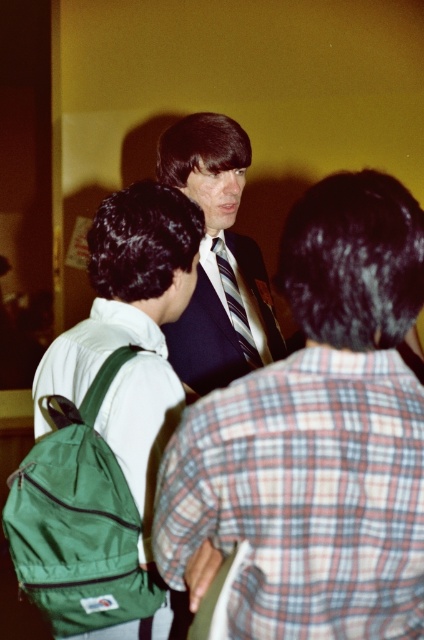
Question: Which point is closer to the camera?

Choices:
 (A) (47, 435)
 (B) (222, 244)
 (C) (346, 515)
 (D) (103, 241)

Answer: (C)

Question: Which point is farther to the camera?

Choices:
 (A) (16, 506)
 (B) (233, 316)
 (C) (156, 250)

Answer: (B)

Question: Does dark blue suit at center have a larger size compared to striped fabric tie at center?

Choices:
 (A) no
 (B) yes

Answer: (B)

Question: Among these points, which one is nearest to the camera?

Choices:
 (A) (214, 253)
 (B) (223, 472)

Answer: (B)

Question: Is dark blue suit at center above green fabric backpack at center?

Choices:
 (A) no
 (B) yes

Answer: (B)

Question: Does green fabric backpack at left have a smaller size compared to striped fabric tie at center?

Choices:
 (A) no
 (B) yes

Answer: (A)